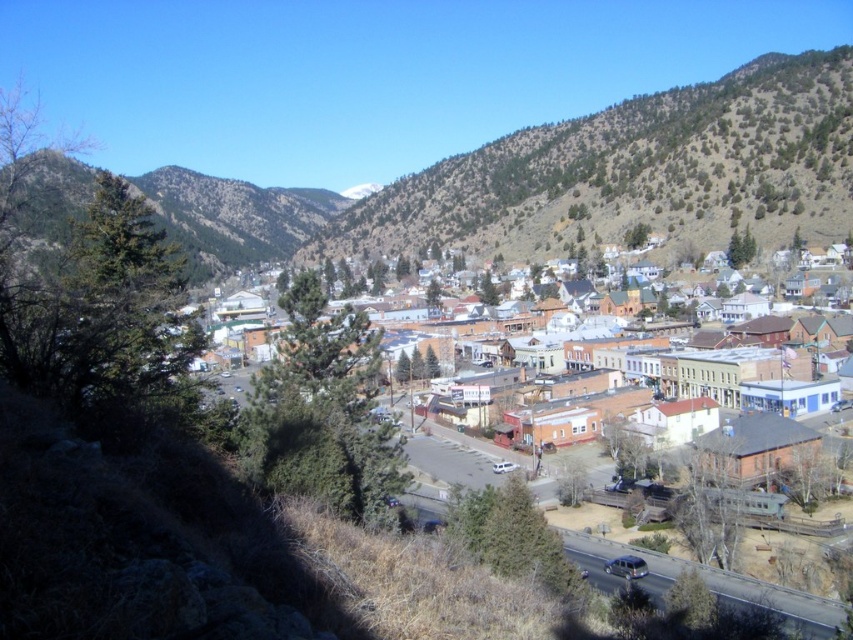
Question: Which object is the closest to the brown brick buildings at center?

Choices:
 (A) brown/dry grassy hill at center
 (B) green leafy hillside at left

Answer: (A)

Question: Can you confirm if brown/dry grassy hill at center is positioned above brown brick buildings at center?

Choices:
 (A) yes
 (B) no

Answer: (A)

Question: Can you confirm if brown/dry grassy hill at center is positioned to the right of green leafy hillside at left?

Choices:
 (A) no
 (B) yes

Answer: (B)

Question: Which object is the closest to the brown brick buildings at center?

Choices:
 (A) green leafy hillside at left
 (B) brown/dry grassy hill at center

Answer: (B)

Question: Is brown/dry grassy hill at center closer to the viewer compared to brown brick buildings at center?

Choices:
 (A) yes
 (B) no

Answer: (B)

Question: Among these points, which one is nearest to the camera?

Choices:
 (A) (223, 250)
 (B) (476, 468)

Answer: (B)